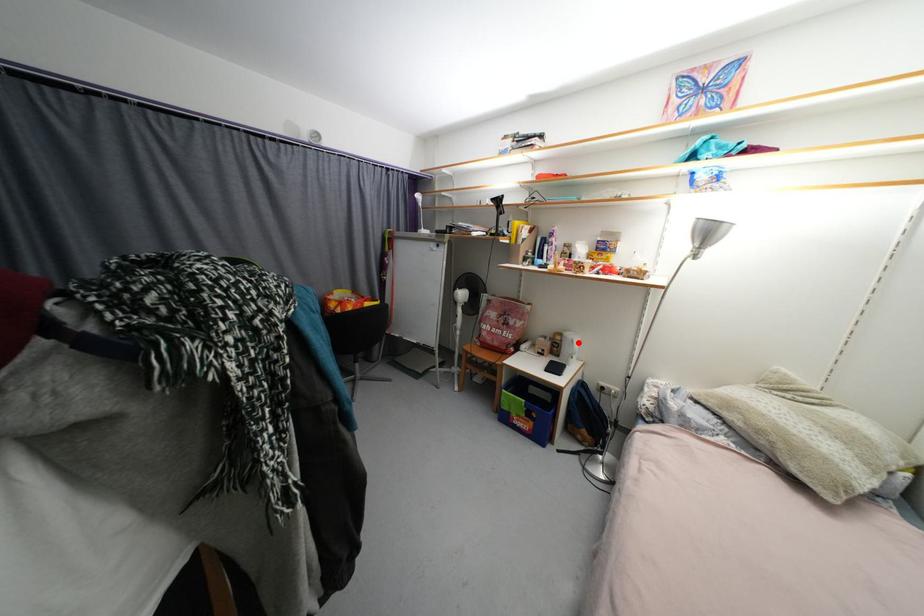
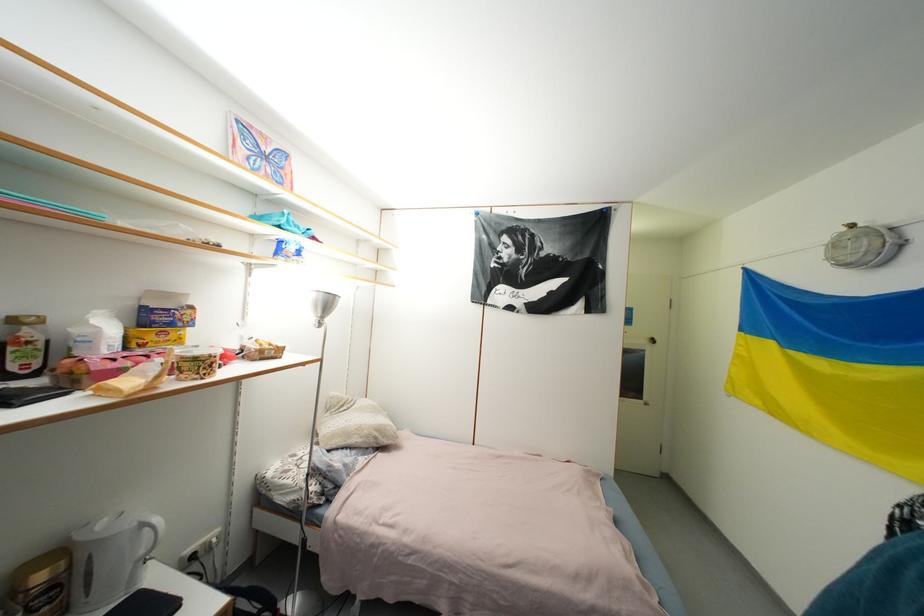
Where in the second image is the point corresponding to the highlighted location from the first image?

(149, 528)